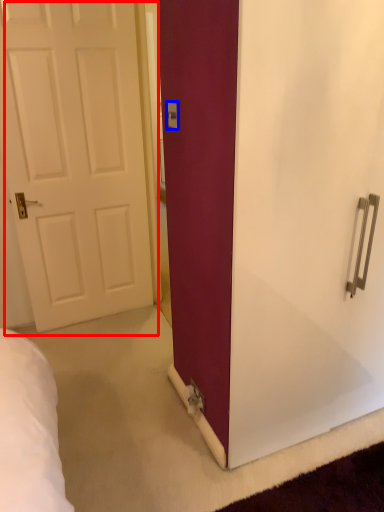
Question: Which object is further to the camera taking this photo, door (highlighted by a red box) or electric outlet (highlighted by a blue box)?

Choices:
 (A) door
 (B) electric outlet

Answer: (A)